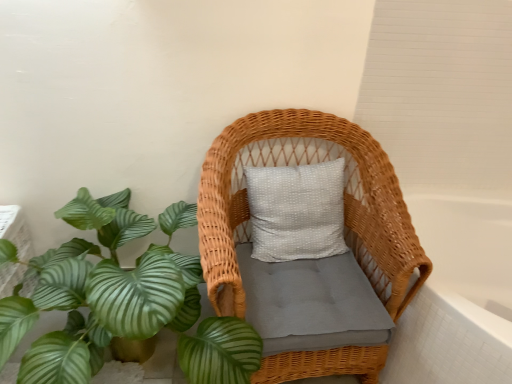
The image size is (512, 384). Describe the element at coordinates (122, 301) in the screenshot. I see `green leafy plant at lower left` at that location.

The width and height of the screenshot is (512, 384). What are the coordinates of `green leafy plant at lower left` in the screenshot? It's located at (122, 301).

Are green leafy plant at lower left and woven wicker chair at center beside each other?

They are not placed beside each other.

From a real-world perspective, which is physically below, green leafy plant at lower left or woven wicker chair at center?

green leafy plant at lower left.

Which of these two, green leafy plant at lower left or woven wicker chair at center, is smaller?

With smaller size is woven wicker chair at center.

Who is taller, green leafy plant at lower left or woven wicker chair at center?

With more height is woven wicker chair at center.

From a real-world perspective, relative to white glossy bathtub at right, is woven wicker chair at center vertically above or below?

Clearly, from a real-world perspective, woven wicker chair at center is above white glossy bathtub at right.

In the scene shown: Is white glossy bathtub at right at the back of woven wicker chair at center?

That's not correct — woven wicker chair at center is not looking away from white glossy bathtub at right.

Considering the relative sizes of woven wicker chair at center and white glossy bathtub at right in the image provided, is woven wicker chair at center smaller than white glossy bathtub at right?

Yes.

Is woven wicker chair at center taller than green leafy plant at lower left?

Yes, woven wicker chair at center is taller than green leafy plant at lower left.

From the image's perspective, is woven wicker chair at center located above or below green leafy plant at lower left?

Based on their image positions, woven wicker chair at center is located above green leafy plant at lower left.

Can you see woven wicker chair at center touching green leafy plant at lower left?

No.

In the scene shown: Measure the distance between green leafy plant at lower left and white glossy bathtub at right.

A distance of 1.22 meters exists between green leafy plant at lower left and white glossy bathtub at right.

Considering the relative positions of green leafy plant at lower left and white glossy bathtub at right in the image provided, is green leafy plant at lower left to the right of white glossy bathtub at right from the viewer's perspective?

In fact, green leafy plant at lower left is to the left of white glossy bathtub at right.

From a real-world perspective, is green leafy plant at lower left physically below white glossy bathtub at right?

No, from a real-world perspective, green leafy plant at lower left is not below white glossy bathtub at right.

Can you tell me how much green leafy plant at lower left and white glossy bathtub at right differ in facing direction?

0.596 degrees separate the facing orientations of green leafy plant at lower left and white glossy bathtub at right.

From the image's perspective, is white glossy bathtub at right on green leafy plant at lower left?

No, from the image's perspective, white glossy bathtub at right is not above green leafy plant at lower left.

From a real-world perspective, is white glossy bathtub at right on top of green leafy plant at lower left?

No.

How much distance is there between white glossy bathtub at right and green leafy plant at lower left?

The distance of white glossy bathtub at right from green leafy plant at lower left is 4.00 feet.

Does white glossy bathtub at right have a greater height compared to green leafy plant at lower left?

No, white glossy bathtub at right is not taller than green leafy plant at lower left.

In terms of size, does white glossy bathtub at right appear bigger or smaller than woven wicker chair at center?

In the image, white glossy bathtub at right appears to be larger than woven wicker chair at center.

Which is closer, (x=451, y=290) or (x=285, y=114)?

The point (x=285, y=114) is in front.

Which object is thinner, white glossy bathtub at right or woven wicker chair at center?

woven wicker chair at center.

Where is `houseplant that appears on the left of woven wicker chair at center`? houseplant that appears on the left of woven wicker chair at center is located at coordinates (122, 301).

The image size is (512, 384). What are the coordinates of `furniture that is in front of the white glossy bathtub at right` in the screenshot? It's located at (344, 202).

Based on their spatial positions, is white glossy bathtub at right or woven wicker chair at center closer to green leafy plant at lower left?

Based on the image, woven wicker chair at center appears to be nearer to green leafy plant at lower left.

From the image, which object appears to be farther from green leafy plant at lower left, woven wicker chair at center or white glossy bathtub at right?

Based on the image, white glossy bathtub at right appears to be further to green leafy plant at lower left.

Which object lies further to the anchor point woven wicker chair at center, white glossy bathtub at right or green leafy plant at lower left?

white glossy bathtub at right is positioned further to the anchor woven wicker chair at center.

Which object lies further to the anchor point woven wicker chair at center, green leafy plant at lower left or white glossy bathtub at right?

white glossy bathtub at right.

Estimate the real-world distances between objects in this image. Which object is closer to white glossy bathtub at right, woven wicker chair at center or green leafy plant at lower left?

woven wicker chair at center.

Based on their spatial positions, is green leafy plant at lower left or woven wicker chair at center further from white glossy bathtub at right?

green leafy plant at lower left.

At what (x,y) coordinates should I click in order to perform the action: click on furniture situated between green leafy plant at lower left and white glossy bathtub at right from left to right. Please return your answer as a coordinate pair (x, y). This screenshot has width=512, height=384. Looking at the image, I should click on (344, 202).